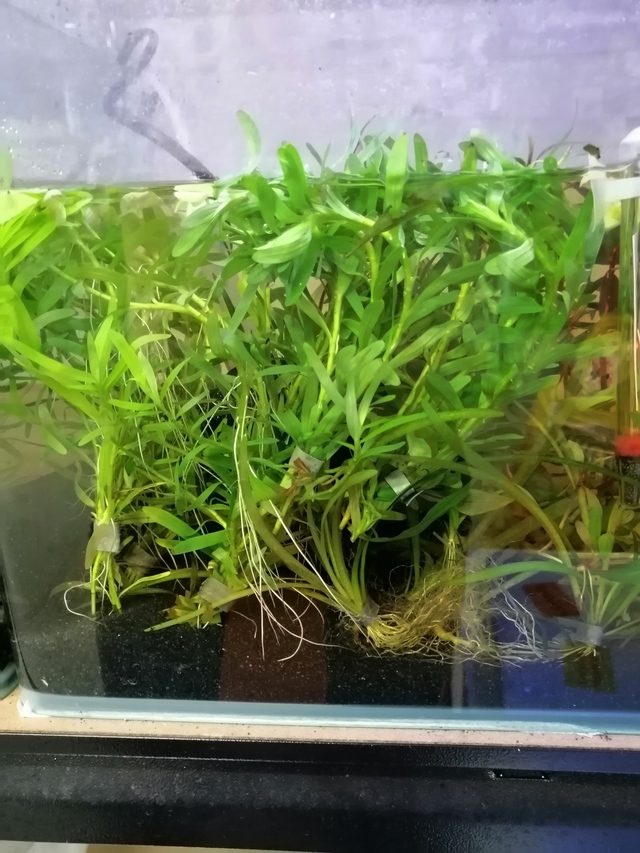
The image size is (640, 853). I want to click on gray wall, so click(x=52, y=119).